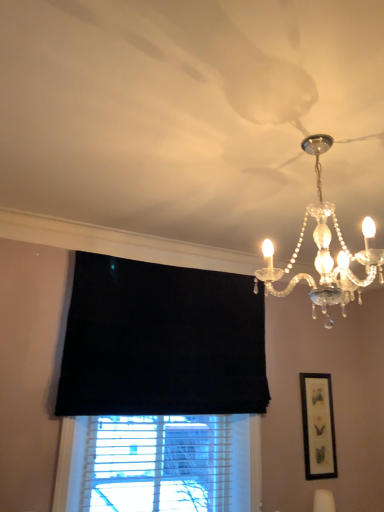
What do you see at coordinates (318, 426) in the screenshot? I see `matte black picture frame at right` at bounding box center [318, 426].

Locate an element on the screen. This screenshot has width=384, height=512. matte black picture frame at right is located at coordinates (318, 426).

Where is `clear crystal chandelier at upper right`? The height and width of the screenshot is (512, 384). clear crystal chandelier at upper right is located at coordinates (325, 252).

The image size is (384, 512). Describe the element at coordinates (325, 252) in the screenshot. I see `clear crystal chandelier at upper right` at that location.

At what (x,y) coordinates should I click in order to perform the action: click on matte black picture frame at right. Please return your answer as a coordinate pair (x, y). The image size is (384, 512). Looking at the image, I should click on [x=318, y=426].

Based on their positions, is clear crystal chandelier at upper right located to the left or right of matte black picture frame at right?

Clearly, clear crystal chandelier at upper right is on the left of matte black picture frame at right in the image.

Is clear crystal chandelier at upper right positioned behind matte black picture frame at right?

No.

Which is in front, point (343, 302) or point (311, 385)?

The point (343, 302) is more forward.

From the image's perspective, is clear crystal chandelier at upper right located above or below matte black picture frame at right?

clear crystal chandelier at upper right is above matte black picture frame at right.

From a real-world perspective, relative to matte black picture frame at right, is clear crystal chandelier at upper right vertically above or below?

clear crystal chandelier at upper right is above matte black picture frame at right.

Looking at their sizes, would you say clear crystal chandelier at upper right is wider or thinner than matte black picture frame at right?

Considering their sizes, clear crystal chandelier at upper right looks broader than matte black picture frame at right.

Does clear crystal chandelier at upper right have a lesser height compared to matte black picture frame at right?

Correct, clear crystal chandelier at upper right is not as tall as matte black picture frame at right.

Which of these two, clear crystal chandelier at upper right or matte black picture frame at right, is smaller?

A: Smaller between the two is matte black picture frame at right.

Is clear crystal chandelier at upper right located outside matte black picture frame at right?

clear crystal chandelier at upper right is positioned outside matte black picture frame at right.

Is clear crystal chandelier at upper right next to matte black picture frame at right and touching it?

No.

Is clear crystal chandelier at upper right positioned with its back to matte black picture frame at right?

clear crystal chandelier at upper right is not turned away from matte black picture frame at right.

What's the angular difference between clear crystal chandelier at upper right and matte black picture frame at right's facing directions?

The facing directions of clear crystal chandelier at upper right and matte black picture frame at right are 3.13 degrees apart.

At what (x,y) coordinates should I click in order to perform the action: click on picture frame below the clear crystal chandelier at upper right (from the image's perspective). Please return your answer as a coordinate pair (x, y). This screenshot has height=512, width=384. Looking at the image, I should click on (318, 426).

Is matte black picture frame at right at the left side of clear crystal chandelier at upper right?

In fact, matte black picture frame at right is to the right of clear crystal chandelier at upper right.

Does matte black picture frame at right come in front of clear crystal chandelier at upper right?

That is False.

Is point (327, 476) closer to viewer compared to point (310, 143)?

No.

From the image's perspective, who appears lower, matte black picture frame at right or clear crystal chandelier at upper right?

matte black picture frame at right.

From a real-world perspective, is matte black picture frame at right positioned over clear crystal chandelier at upper right based on gravity?

No, from a real-world perspective, matte black picture frame at right is not on top of clear crystal chandelier at upper right.

Can you confirm if matte black picture frame at right is thinner than clear crystal chandelier at upper right?

Yes, matte black picture frame at right is thinner than clear crystal chandelier at upper right.

Can you confirm if matte black picture frame at right is shorter than clear crystal chandelier at upper right?

No, matte black picture frame at right is not shorter than clear crystal chandelier at upper right.

Based on their sizes in the image, would you say matte black picture frame at right is bigger or smaller than clear crystal chandelier at upper right?

Considering their sizes, matte black picture frame at right takes up less space than clear crystal chandelier at upper right.

Do you think matte black picture frame at right is within clear crystal chandelier at upper right, or outside of it?

matte black picture frame at right is located beyond the bounds of clear crystal chandelier at upper right.

Is there a large distance between matte black picture frame at right and clear crystal chandelier at upper right?

matte black picture frame at right is far away from clear crystal chandelier at upper right.

Is matte black picture frame at right oriented towards clear crystal chandelier at upper right?

No, matte black picture frame at right does not turn towards clear crystal chandelier at upper right.

At what (x,y) coordinates should I click in order to perform the action: click on lamp lying in front of the matte black picture frame at right. Please return your answer as a coordinate pair (x, y). The width and height of the screenshot is (384, 512). Looking at the image, I should click on (325, 252).

You are a GUI agent. You are given a task and a screenshot of the screen. Output one action in this format:
    pyautogui.click(x=<x>, y=<y>)
    Task: Click on the lamp on the left of the matte black picture frame at right
    
    Given the screenshot: What is the action you would take?
    pyautogui.click(x=325, y=252)

The width and height of the screenshot is (384, 512). Identify the location of lamp in front of the matte black picture frame at right. (325, 252).